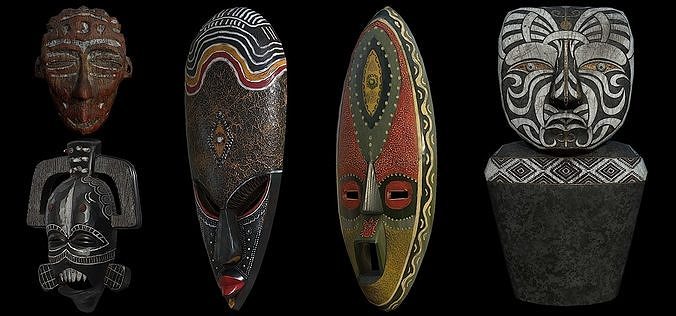
The image size is (676, 316). Identify the location of stand. (568, 240).